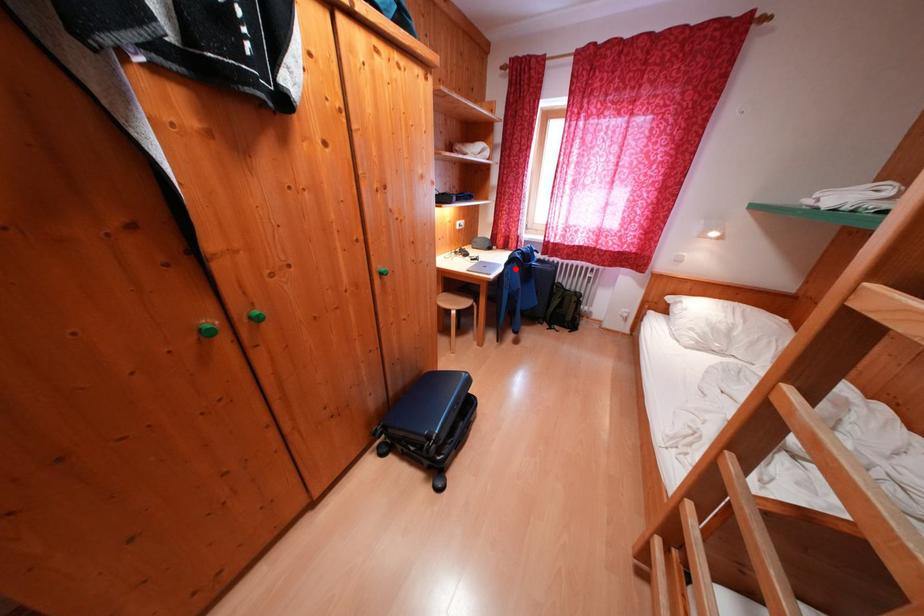
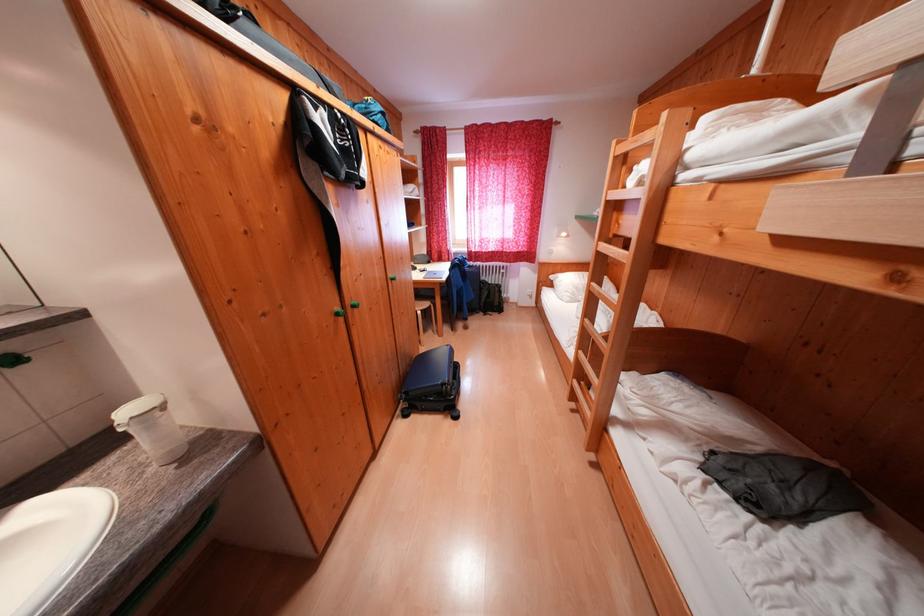
The point at the highlighted location is marked in the first image. Where is the corresponding point in the second image?

(458, 274)